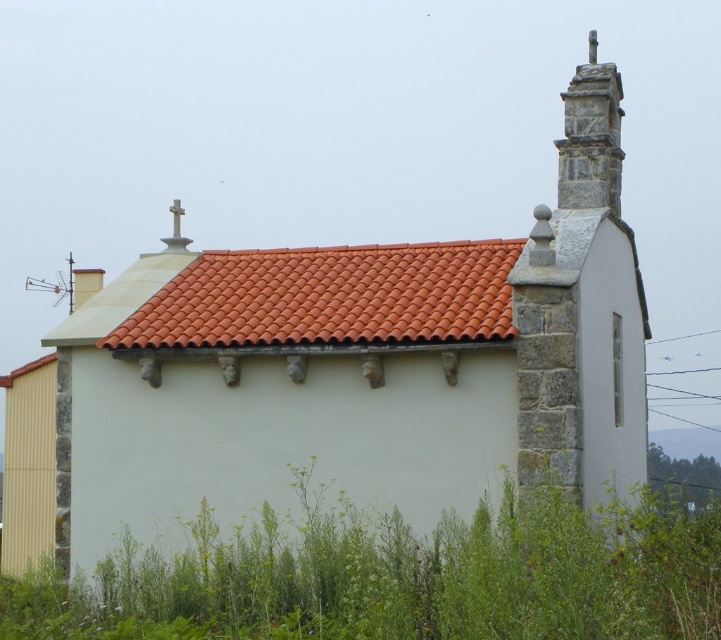
What do you see at coordinates (329, 298) in the screenshot? I see `terracotta tiles at center` at bounding box center [329, 298].

Between terracotta tiles at center and stone cross at upper right, which one is positioned higher?

stone cross at upper right is higher up.

This screenshot has height=640, width=721. Describe the element at coordinates (329, 298) in the screenshot. I see `terracotta tiles at center` at that location.

Locate an element on the screen. terracotta tiles at center is located at coordinates (329, 298).

Between green grass at lower left and stone cross at upper right, which one appears on the left side from the viewer's perspective?

Positioned to the left is green grass at lower left.

Between point (398, 611) and point (593, 44), which one is positioned in front?

Positioned in front is point (398, 611).

This screenshot has height=640, width=721. Identify the location of green grass at lower left. (402, 579).

Can you confirm if green grass at lower left is bigger than terracotta tiles at center?

Yes, green grass at lower left is bigger than terracotta tiles at center.

Is green grass at lower left above terracotta tiles at center?

Incorrect, green grass at lower left is not positioned above terracotta tiles at center.

Which is in front, point (420, 589) or point (472, 275)?

Point (420, 589) is in front.

You are a GUI agent. You are given a task and a screenshot of the screen. Output one action in this format:
    pyautogui.click(x=<x>, y=<y>)
    Task: Click on the green grass at lower left
    Image resolution: width=721 pixels, height=640 pixels.
    Given the screenshot: What is the action you would take?
    pyautogui.click(x=402, y=579)